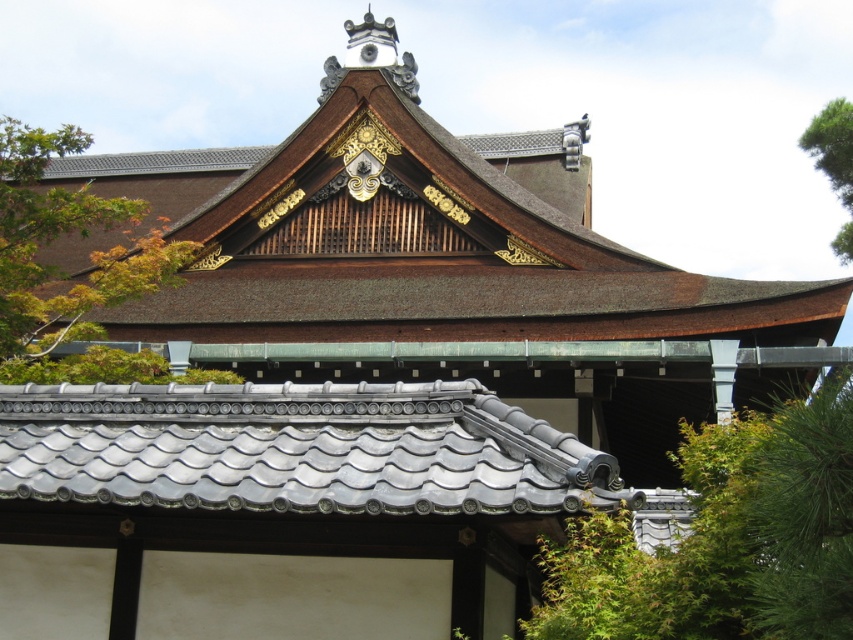
Question: Which object is the closest to the gray tile roof at center?

Choices:
 (A) green leafy tree at upper right
 (B) brown tile roof at upper center

Answer: (B)

Question: Is gray tile roof at center to the left of green leafy tree at upper left from the viewer's perspective?

Choices:
 (A) no
 (B) yes

Answer: (A)

Question: Which point is closer to the camera taking this photo?

Choices:
 (A) (811, 152)
 (B) (257, 385)
 (C) (581, 288)

Answer: (B)

Question: Which of the following is the farthest from the observer?

Choices:
 (A) green leafy tree at upper right
 (B) gray tile roof at center
 (C) brown tile roof at upper center
 (D) green leafy tree at upper left

Answer: (A)

Question: Is brown tile roof at upper center positioned at the back of green leafy tree at upper left?

Choices:
 (A) yes
 (B) no

Answer: (A)

Question: Is brown tile roof at upper center below green leafy tree at upper right?

Choices:
 (A) no
 (B) yes

Answer: (B)